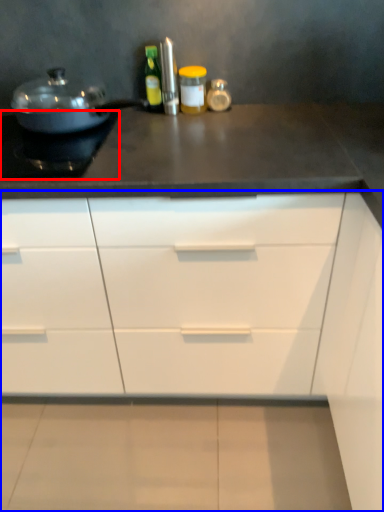
Question: Which object is closer to the camera taking this photo, appliance (highlighted by a red box) or cabinetry (highlighted by a blue box)?

Choices:
 (A) appliance
 (B) cabinetry

Answer: (B)